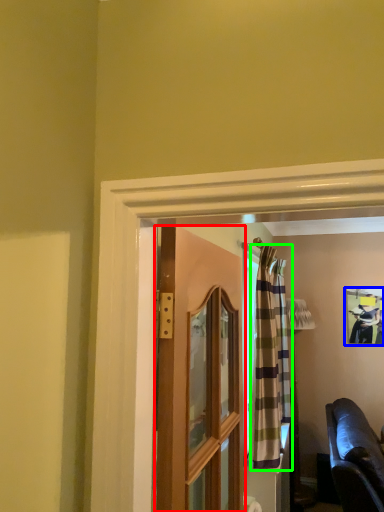
Question: Which is nearer to the door (highlighted by a red box)? picture frame (highlighted by a blue box) or curtain (highlighted by a green box).

Choices:
 (A) picture frame
 (B) curtain

Answer: (B)